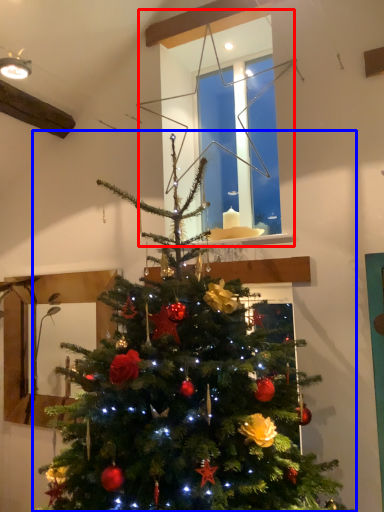
Question: Which object is further to the camera taking this photo, window (highlighted by a red box) or christmas tree (highlighted by a blue box)?

Choices:
 (A) window
 (B) christmas tree

Answer: (A)